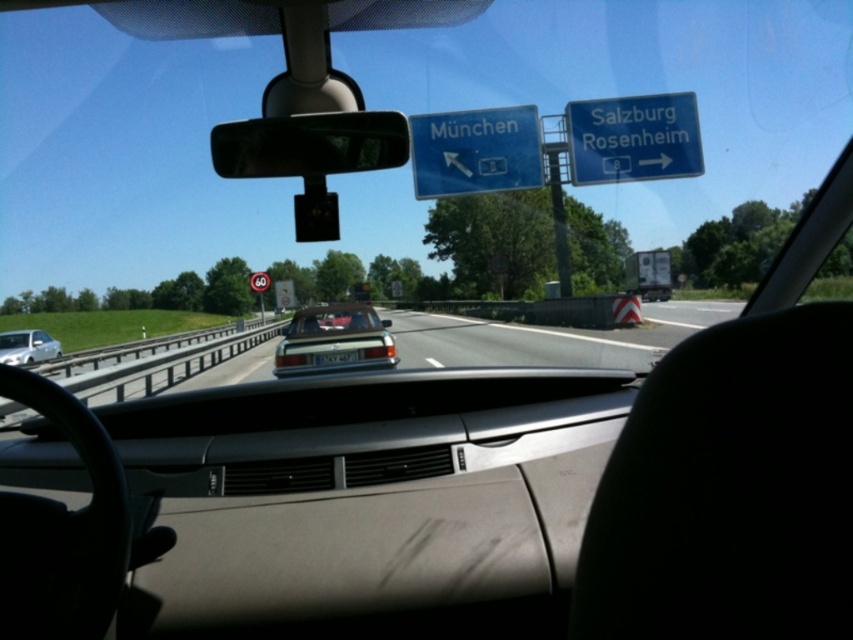
Question: Based on their relative distances, which object is nearer to the red circular sign at center?

Choices:
 (A) white glossy sedan at left
 (B) blue plastic sign at upper right
 (C) white plastic license plate at center

Answer: (A)

Question: Is black plastic view mirror at center thinner than white glossy sedan at left?

Choices:
 (A) no
 (B) yes

Answer: (B)

Question: Which of these objects is positioned farthest from the blue plastic sign at upper right?

Choices:
 (A) white glossy sedan at left
 (B) white plastic license plate at center
 (C) red circular sign at center

Answer: (A)

Question: Can you confirm if blue plastic sign at upper right is positioned below white plastic license plate at center?

Choices:
 (A) no
 (B) yes

Answer: (A)

Question: In this image, where is black plastic view mirror at center located relative to shiny metallic sedan at center?

Choices:
 (A) left
 (B) right

Answer: (B)

Question: Which point is farther to the camera?

Choices:
 (A) (262, 284)
 (B) (508, 150)
 (C) (343, 356)

Answer: (A)